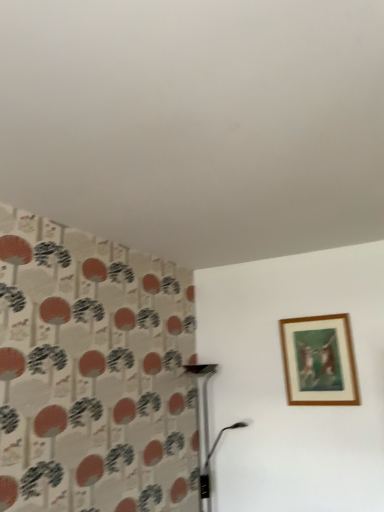
Question: Is point (190, 372) closer or farther from the camera than point (289, 347)?

Choices:
 (A) farther
 (B) closer

Answer: (A)

Question: In the image, is metallic silver table lamp at lower center on the left side or the right side of wooden frame at upper right?

Choices:
 (A) right
 (B) left

Answer: (B)

Question: Is metallic silver table lamp at lower center wider or thinner than wooden frame at upper right?

Choices:
 (A) thin
 (B) wide

Answer: (B)

Question: Is point (331, 352) positioned closer to the camera than point (218, 436)?

Choices:
 (A) farther
 (B) closer

Answer: (B)

Question: Is wooden frame at upper right to the left or to the right of metallic silver table lamp at lower center in the image?

Choices:
 (A) right
 (B) left

Answer: (A)

Question: Considering the positions of wooden frame at upper right and metallic silver table lamp at lower center in the image, is wooden frame at upper right wider or thinner than metallic silver table lamp at lower center?

Choices:
 (A) wide
 (B) thin

Answer: (B)

Question: Is wooden frame at upper right bigger or smaller than metallic silver table lamp at lower center?

Choices:
 (A) big
 (B) small

Answer: (B)